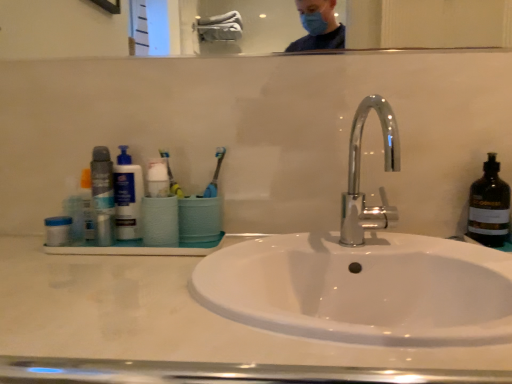
You are a GUI agent. You are given a task and a screenshot of the screen. Output one action in this format:
    pyautogui.click(x=<x>, y=<y>)
    Task: Click on the free space in front of matte black deodorant at left
    The image size is (512, 384).
    Given the screenshot: What is the action you would take?
    pyautogui.click(x=81, y=265)